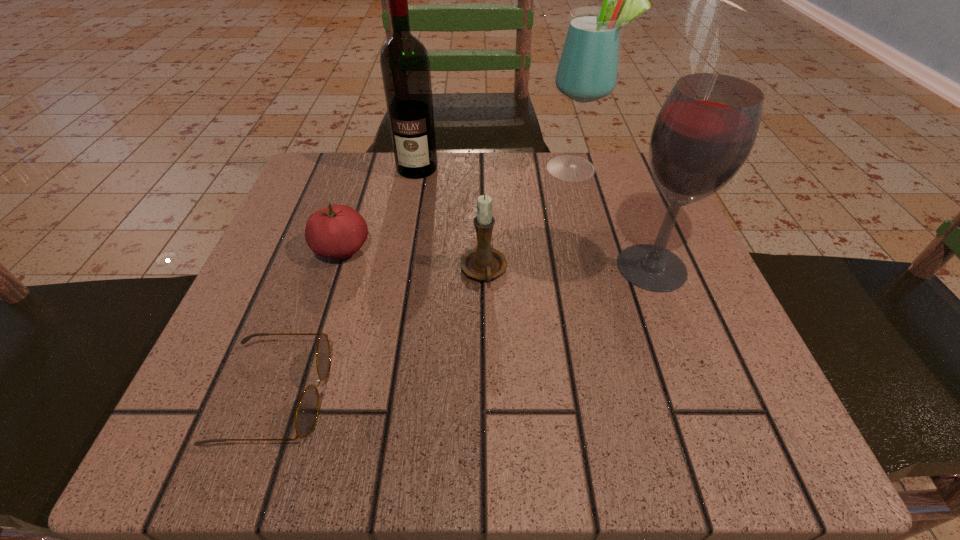
Image resolution: width=960 pixels, height=540 pixels. Find the location of `vacant space at the left edge of the desktop`. vacant space at the left edge of the desktop is located at coordinates (245, 367).

Locate an element on the screen. The image size is (960, 540). free space at the right edge of the desktop is located at coordinates (614, 235).

Where is `vacant space at the near left corner`? Image resolution: width=960 pixels, height=540 pixels. vacant space at the near left corner is located at coordinates tap(249, 432).

What are the coordinates of `free location at the far right corner` in the screenshot? It's located at (623, 152).

Find the location of a particular element. blank region between the candle holder and the fourth object from right to left is located at coordinates (450, 220).

The width and height of the screenshot is (960, 540). I want to click on free spot between the shortest object and the second shortest object, so pos(309,322).

I want to click on free point between the fourth shortest object and the candle holder, so click(x=568, y=269).

Locate an element on the screen. free space between the fifth tallest object and the leftmost alcohol is located at coordinates pos(379,209).

Where is `vacant area that lies between the fourth object from left to right and the tomato`? The image size is (960, 540). vacant area that lies between the fourth object from left to right and the tomato is located at coordinates (413, 261).

The height and width of the screenshot is (540, 960). Identify the location of free spot between the fourth tallest object and the tomato. (413, 261).